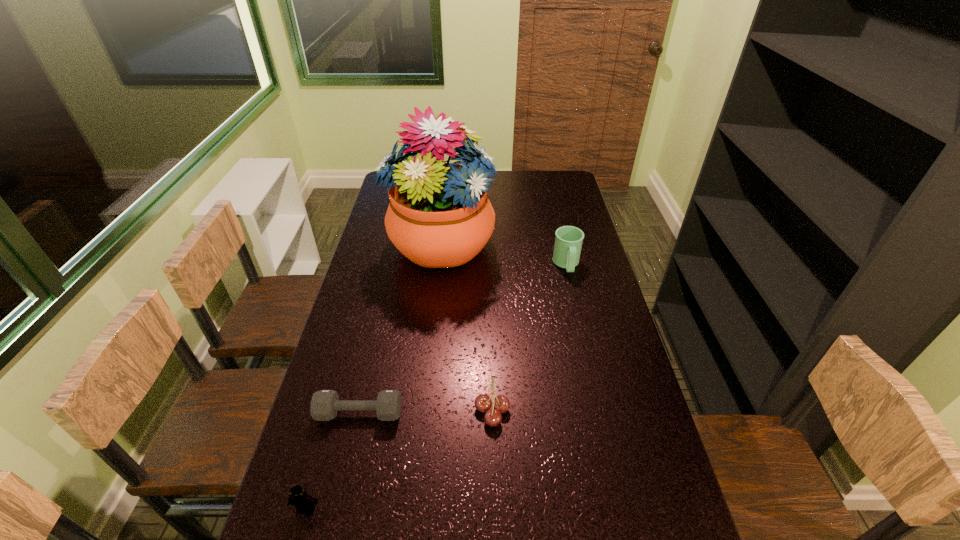
Find the location of a particular element. This screenshot has width=960, height=540. free space located on the leaves of the cherry is located at coordinates (355, 410).

What are the coordinates of `free space located 0.140m on the back of the dumbbell` in the screenshot? It's located at (372, 359).

Image resolution: width=960 pixels, height=540 pixels. I want to click on flower arrangement that is at the left edge, so click(439, 215).

This screenshot has width=960, height=540. Find the location of `Lego that is at the left edge`. Lego that is at the left edge is located at coordinates (301, 500).

This screenshot has width=960, height=540. What are the coordinates of `dumbbell situated at the left edge` in the screenshot? It's located at (325, 404).

Locate an element on the screen. The image size is (960, 540). object at the right edge is located at coordinates (568, 241).

In the image, there is a desktop. Where is `vacant space at the left edge`? The width and height of the screenshot is (960, 540). vacant space at the left edge is located at coordinates (370, 334).

In the image, there is a desktop. Identify the location of vacant space at the right edge. The image size is (960, 540). (629, 497).

What are the coordinates of `vacant area that lies between the flower arrangement and the dumbbell` in the screenshot? It's located at (400, 328).

Image resolution: width=960 pixels, height=540 pixels. Find the location of `unoccupied area between the cherry and the tallest object`. unoccupied area between the cherry and the tallest object is located at coordinates (467, 327).